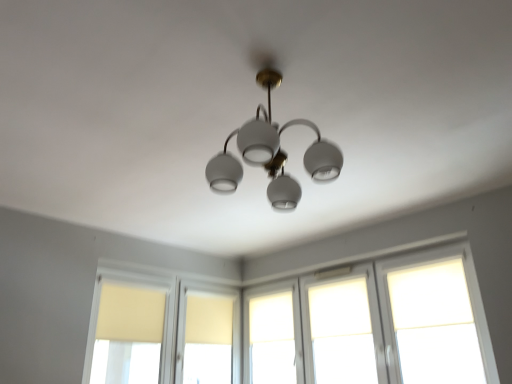
This screenshot has height=384, width=512. What are the coordinates of `translucent glass window at center, which ranks as the 5th window in left-to-right order` in the screenshot? It's located at (340, 333).

You are a GUI agent. You are given a task and a screenshot of the screen. Output one action in this format:
    pyautogui.click(x=<x>, y=<y>)
    Task: Click on the matte yellow curtain at left, the sixth window in the right-to-left sequence
    
    Given the screenshot: What is the action you would take?
    pyautogui.click(x=129, y=333)

At what (x,y) coordinates should I click in order to perform the action: click on white matte glass window at upper right, which is counted as the 1th window, starting from the right. Please return your answer as a coordinate pair (x, y). The width and height of the screenshot is (512, 384). Looking at the image, I should click on (435, 325).

Measure the distance between point (443,283) and camera.

The distance of point (443,283) from camera is 10.58 feet.

What are the coordinates of `white matte window at center, the fourth window from the left` in the screenshot? It's located at (297, 326).

Identify the location of beige fabric curtain at lower left. The height and width of the screenshot is (384, 512). point(130,313).

Which object is further away from the camera taking this photo, beige fabric curtain at lower left or matte yellow curtain at left, the sixth window in the right-to-left sequence?

beige fabric curtain at lower left is further away from the camera.

From the image's perspective, which is above, beige fabric curtain at lower left or matte yellow curtain at left, the sixth window in the right-to-left sequence?

beige fabric curtain at lower left, from the image's perspective.

Is beige fabric curtain at lower left oriented towards matte yellow curtain at left, the first window from the left?

Yes, beige fabric curtain at lower left faces towards matte yellow curtain at left, the first window from the left.

Can you confirm if beige fabric curtain at lower left is positioned to the right of matte yellow curtain at left, the first window from the left?

In fact, beige fabric curtain at lower left is to the left of matte yellow curtain at left, the first window from the left.

Is translucent glass window at center, which is the 2th window in right-to-left order, wider than white matte window at center, the fourth window positioned from the right?

In fact, translucent glass window at center, which is the 2th window in right-to-left order, might be narrower than white matte window at center, the fourth window positioned from the right.

Would you say translucent glass window at center, which ranks as the 5th window in left-to-right order, is outside white matte window at center, the fourth window positioned from the right?

translucent glass window at center, which ranks as the 5th window in left-to-right order, lies outside white matte window at center, the fourth window positioned from the right,'s area.

Consider the image. How different are the orientations of translucent glass window at center, which is the 2th window in right-to-left order, and white matte window at center, which is counted as the 3th window, starting from the left, in degrees?

There is a 0.299-degree angle between the facing directions of translucent glass window at center, which is the 2th window in right-to-left order, and white matte window at center, which is counted as the 3th window, starting from the left.

From a real-world perspective, relative to white matte window at center, the fourth window positioned from the right, is translucent glass window at center, which ranks as the 5th window in left-to-right order, vertically above or below?

translucent glass window at center, which ranks as the 5th window in left-to-right order, is situated lower than white matte window at center, the fourth window positioned from the right, in the real world.

Considering the relative sizes of matte yellow curtain at left, the first window from the left, and matte yellow window at center, placed as the second window when sorted from left to right, in the image provided, is matte yellow curtain at left, the first window from the left, smaller than matte yellow window at center, placed as the second window when sorted from left to right,?

Actually, matte yellow curtain at left, the first window from the left, might be larger than matte yellow window at center, placed as the second window when sorted from left to right.

Between matte yellow curtain at left, the sixth window in the right-to-left sequence, and matte yellow window at center, placed as the 5th window when sorted from right to left, which one appears on the left side from the viewer's perspective?

From the viewer's perspective, matte yellow curtain at left, the sixth window in the right-to-left sequence, appears more on the left side.

From a real-world perspective, between matte yellow curtain at left, the sixth window in the right-to-left sequence, and matte yellow window at center, placed as the 5th window when sorted from right to left, who is vertically lower?

matte yellow curtain at left, the sixth window in the right-to-left sequence, is physically lower.

Based on the photo, considering the relative positions of matte yellow curtain at left, the sixth window in the right-to-left sequence, and matte yellow window at center, placed as the second window when sorted from left to right, in the image provided, is matte yellow curtain at left, the sixth window in the right-to-left sequence, in front of matte yellow window at center, placed as the second window when sorted from left to right,?

Yes, the depth of matte yellow curtain at left, the sixth window in the right-to-left sequence, is less than that of matte yellow window at center, placed as the second window when sorted from left to right.

From the picture: Is matte yellow window at center, placed as the second window when sorted from left to right, turned away from white matte glass window at upper right, which is counted as the 1th window, starting from the right?

A: No, matte yellow window at center, placed as the second window when sorted from left to right, is not facing away from white matte glass window at upper right, which is counted as the 1th window, starting from the right.

Considering the points (198, 379) and (442, 338), which point is in front, point (198, 379) or point (442, 338)?

Point (442, 338)

In the scene shown: From the image's perspective, between matte yellow window at center, placed as the second window when sorted from left to right, and white matte glass window at upper right, which is counted as the 1th window, starting from the right, who is located below?

matte yellow window at center, placed as the second window when sorted from left to right, from the image's perspective.

Who is more distant, matte yellow window at center, placed as the second window when sorted from left to right, or white matte glass window at upper right, which ranks as the sixth window in left-to-right order?

matte yellow window at center, placed as the second window when sorted from left to right, is further from the camera.

From the image's perspective, between translucent glass window at center, which ranks as the 5th window in left-to-right order, and matte yellow curtain at left, the sixth window in the right-to-left sequence, which one is located above?

translucent glass window at center, which ranks as the 5th window in left-to-right order, is shown above in the image.

From the image's perspective, starting from the matte yellow curtain at left, the sixth window in the right-to-left sequence, which window is the 2nd one above? Please provide its 2D coordinates.

[(340, 333)]

How different are the orientations of translucent glass window at center, which is the 2th window in right-to-left order, and matte yellow curtain at left, the first window from the left, in degrees?

The angle between the facing direction of translucent glass window at center, which is the 2th window in right-to-left order, and the facing direction of matte yellow curtain at left, the first window from the left, is 89.2 degrees.

Looking at this image, is translucent glass window at center, which ranks as the 5th window in left-to-right order, turned away from matte yellow curtain at left, the sixth window in the right-to-left sequence?

That's not correct — translucent glass window at center, which ranks as the 5th window in left-to-right order, is not looking away from matte yellow curtain at left, the sixth window in the right-to-left sequence.

Find the location of a particular element. The height and width of the screenshot is (384, 512). the 1st window behind the beige fabric curtain at lower left, starting your count from the anchor is located at coordinates (340, 333).

From a real-world perspective, which is physically above, translucent glass window at center, which is the 2th window in right-to-left order, or beige fabric curtain at lower left?

beige fabric curtain at lower left.

From the image's perspective, who appears lower, translucent glass window at center, which is the 2th window in right-to-left order, or beige fabric curtain at lower left?

From the image's view, beige fabric curtain at lower left is below.

Which point is more distant from viewer, (354, 383) or (146, 342)?

The point (146, 342) is more distant.

Is beige fabric curtain at lower left inside white matte glass window at upper right, which is counted as the 1th window, starting from the right?

That's incorrect, beige fabric curtain at lower left is not inside white matte glass window at upper right, which is counted as the 1th window, starting from the right.

In the image, there is a white matte glass window at upper right, which is counted as the 1th window, starting from the right. Identify the location of curtain below it (from a real-world perspective). (130, 313).

Is white matte glass window at upper right, which is counted as the 1th window, starting from the right, positioned with its back to beige fabric curtain at lower left?

No.

How far apart are white matte glass window at upper right, which ranks as the sixth window in left-to-right order, and beige fabric curtain at lower left?

A distance of 7.42 feet exists between white matte glass window at upper right, which ranks as the sixth window in left-to-right order, and beige fabric curtain at lower left.

The image size is (512, 384). Identify the location of window that is the 2nd object located below the beige fabric curtain at lower left (from the image's perspective). (129, 333).

Find the location of a particular element. This screenshot has width=512, height=384. the 2nd window directly above the translucent glass window at center, which ranks as the 5th window in left-to-right order (from a real-world perspective) is located at coordinates (272, 335).

Which object lies further to the anchor point matte yellow window at center, placed as the second window when sorted from left to right, white matte window at center, the fourth window positioned from the right, or translucent glass window at center, which ranks as the 5th window in left-to-right order?

Among the two, translucent glass window at center, which ranks as the 5th window in left-to-right order, is located further to matte yellow window at center, placed as the second window when sorted from left to right.

From the image, which object appears to be farther from white matte window at center, the fourth window from the left, beige fabric curtain at lower left or white matte glass window at upper right, which is counted as the 1th window, starting from the right?

Based on the image, beige fabric curtain at lower left appears to be further to white matte window at center, the fourth window from the left.

From the image, which object appears to be farther from matte yellow curtain at left, the first window from the left, translucent glass window at center, which is the 2th window in right-to-left order, or matte yellow window at center, placed as the 5th window when sorted from right to left?

translucent glass window at center, which is the 2th window in right-to-left order.

Consider the image. From the image, which object appears to be nearer to white matte window at center, the fourth window positioned from the right, matte yellow window at center, placed as the second window when sorted from left to right, or white matte glass window at upper right, which is counted as the 1th window, starting from the right?

matte yellow window at center, placed as the second window when sorted from left to right, lies closer to white matte window at center, the fourth window positioned from the right, than the other object.

Considering their positions, is matte yellow curtain at left, the sixth window in the right-to-left sequence, positioned further to white matte glass window at upper right, which is counted as the 1th window, starting from the right, than beige fabric curtain at lower left?

beige fabric curtain at lower left.

Looking at the image, which one is located further to matte yellow window at center, placed as the second window when sorted from left to right, beige fabric curtain at lower left or matte yellow curtain at left, the sixth window in the right-to-left sequence?

beige fabric curtain at lower left is positioned further to the anchor matte yellow window at center, placed as the second window when sorted from left to right.

Estimate the real-world distances between objects in this image. Which object is further from white matte window at center, which is counted as the 3th window, starting from the left, white matte glass window at upper right, which ranks as the sixth window in left-to-right order, or white matte window at center, the fourth window from the left?

white matte glass window at upper right, which ranks as the sixth window in left-to-right order, lies further to white matte window at center, which is counted as the 3th window, starting from the left, than the other object.

From the image, which object appears to be nearer to beige fabric curtain at lower left, white matte window at center, the fourth window positioned from the right, or white matte window at center, the 3th window from the right?

white matte window at center, the fourth window positioned from the right, is closer to beige fabric curtain at lower left.

Where is `curtain between matte yellow curtain at left, the sixth window in the right-to-left sequence, and matte yellow window at center, placed as the 5th window when sorted from right to left, along the z-axis`? Image resolution: width=512 pixels, height=384 pixels. curtain between matte yellow curtain at left, the sixth window in the right-to-left sequence, and matte yellow window at center, placed as the 5th window when sorted from right to left, along the z-axis is located at coordinates (130, 313).

Identify the location of window between matte yellow curtain at left, the first window from the left, and white matte window at center, which is counted as the 3th window, starting from the left, from left to right. (208, 339).